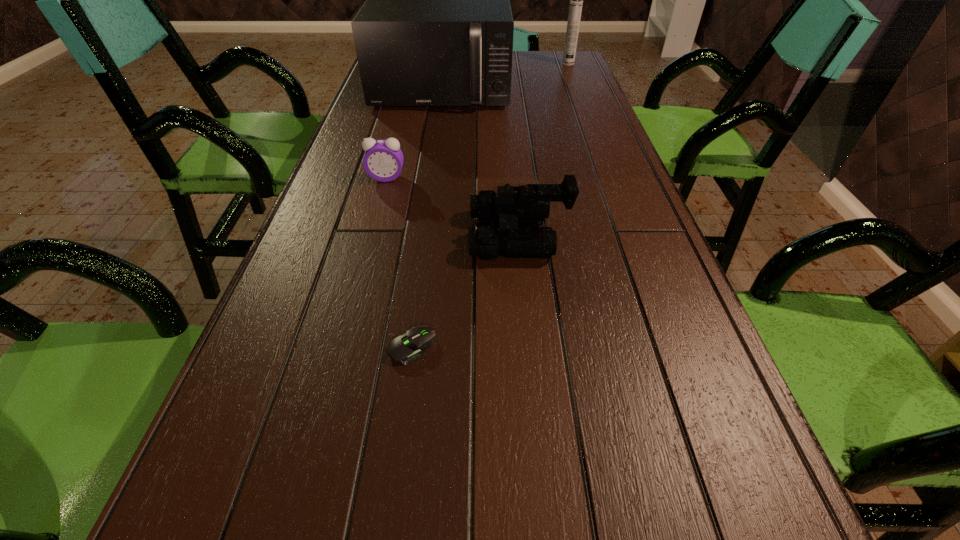
Where is `aerosol can`? aerosol can is located at coordinates (576, 0).

Identify the location of microwave oven. (436, 29).

Identify the location of the fourth farthest object. (525, 207).

Locate an element on the screen. The height and width of the screenshot is (540, 960). binoculars is located at coordinates click(x=525, y=207).

Identify the location of alarm clock. (383, 160).

At what (x,y) coordinates should I click in order to perform the action: click on the third nearest object. Please return your answer as a coordinate pair (x, y). This screenshot has width=960, height=540. Looking at the image, I should click on (383, 160).

At what (x,y) coordinates should I click in order to perform the action: click on the nearest object. Please return your answer as a coordinate pair (x, y). The width and height of the screenshot is (960, 540). Looking at the image, I should click on (409, 347).

I want to click on computer mouse, so click(409, 347).

Find the location of `vacant area located on the front of the aerosol can`. vacant area located on the front of the aerosol can is located at coordinates (588, 114).

This screenshot has width=960, height=540. What are the coordinates of `free space located 0.260m on the front-facing side of the microwave oven` in the screenshot? It's located at (431, 159).